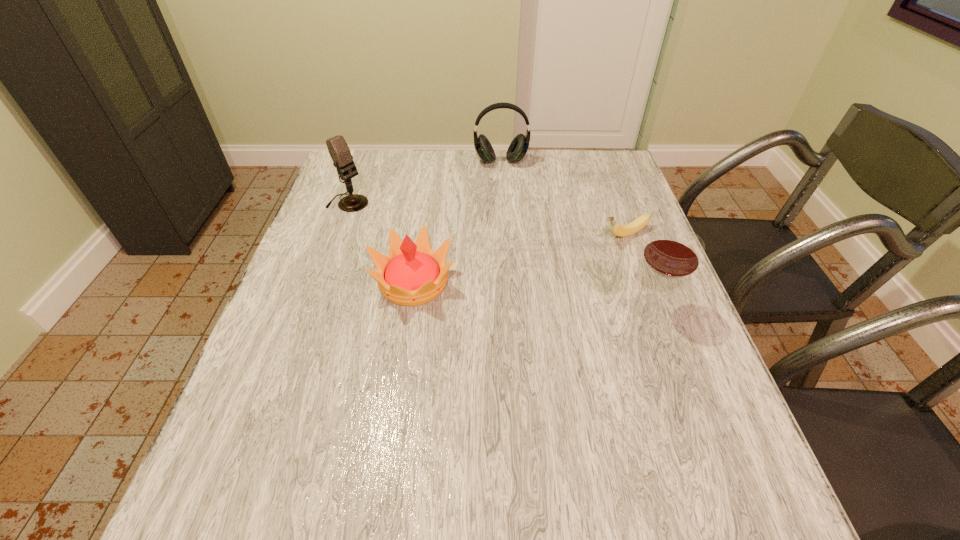
The width and height of the screenshot is (960, 540). Find the location of `the second object from left to right`. the second object from left to right is located at coordinates (412, 274).

Find the location of a particular element. This screenshot has height=540, width=960. crown is located at coordinates (412, 274).

You are a GUI agent. You are given a task and a screenshot of the screen. Output one action in this format:
    pyautogui.click(x=<x>, y=<y>)
    Task: Click on the wineglass
    This screenshot has height=540, width=960.
    Given the screenshot: What is the action you would take?
    pyautogui.click(x=672, y=252)

This screenshot has height=540, width=960. I want to click on the second farthest object, so click(339, 151).

This screenshot has height=540, width=960. In order to click on the leftmost object in this screenshot , I will do `click(339, 151)`.

In order to click on the farthest object in this screenshot , I will do `click(518, 148)`.

The height and width of the screenshot is (540, 960). I want to click on the third object from left to right, so click(x=518, y=148).

Identify the location of the third farthest object. (629, 229).

This screenshot has height=540, width=960. Identify the location of the shortest object. (629, 229).

What are the coordinates of `vacant region located on the right of the second object from left to right` in the screenshot? It's located at (490, 282).